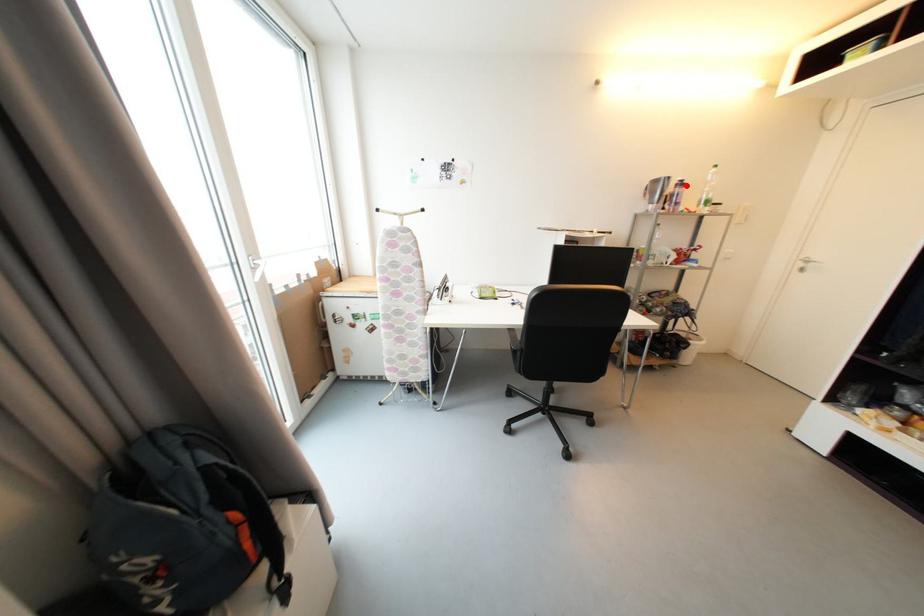
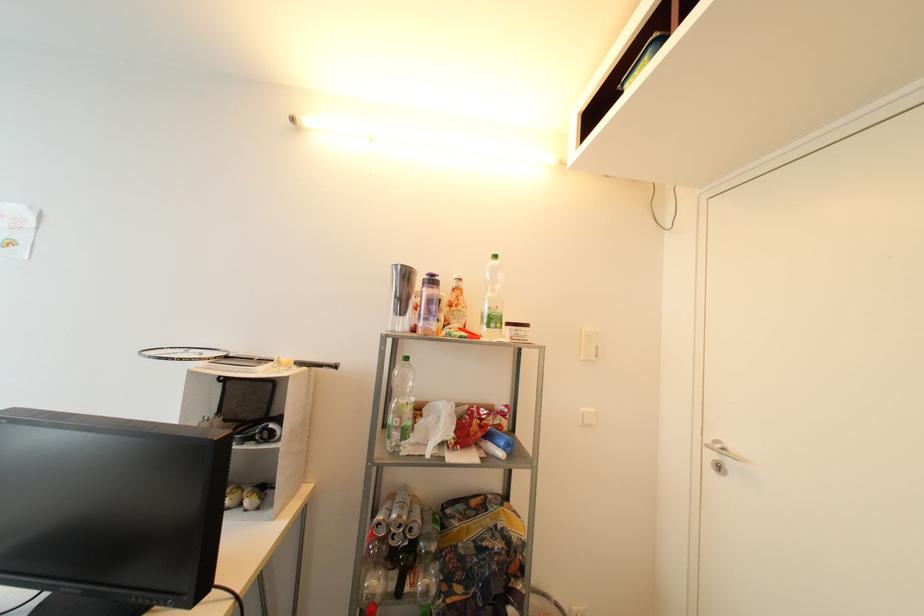
Find the pixel in the second image that matches the highlighted location in the first image.

(438, 283)